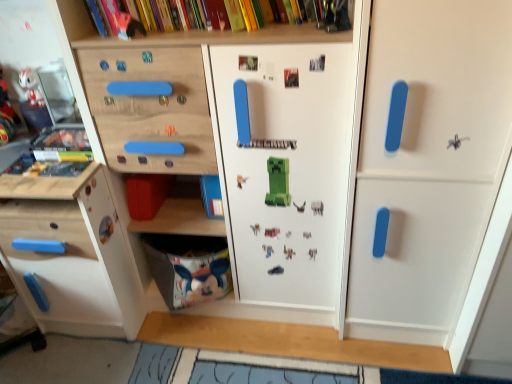
Question: Considering the positions of point (34, 77) and point (167, 306), is point (34, 77) closer or farther from the camera than point (167, 306)?

Choices:
 (A) farther
 (B) closer

Answer: (B)

Question: Is matte plastic rabbit at upper left to the left or to the right of white fabric bag at lower center in the image?

Choices:
 (A) right
 (B) left

Answer: (B)

Question: Estimate the real-world distances between objects in this image. Which object is farther from the white fabric bag at lower center?

Choices:
 (A) matte plastic rabbit at upper left
 (B) white matte door at right

Answer: (A)

Question: Estimate the real-world distances between objects in this image. Which object is farther from the matte plastic rabbit at upper left?

Choices:
 (A) white matte door at right
 (B) white fabric bag at lower center

Answer: (A)